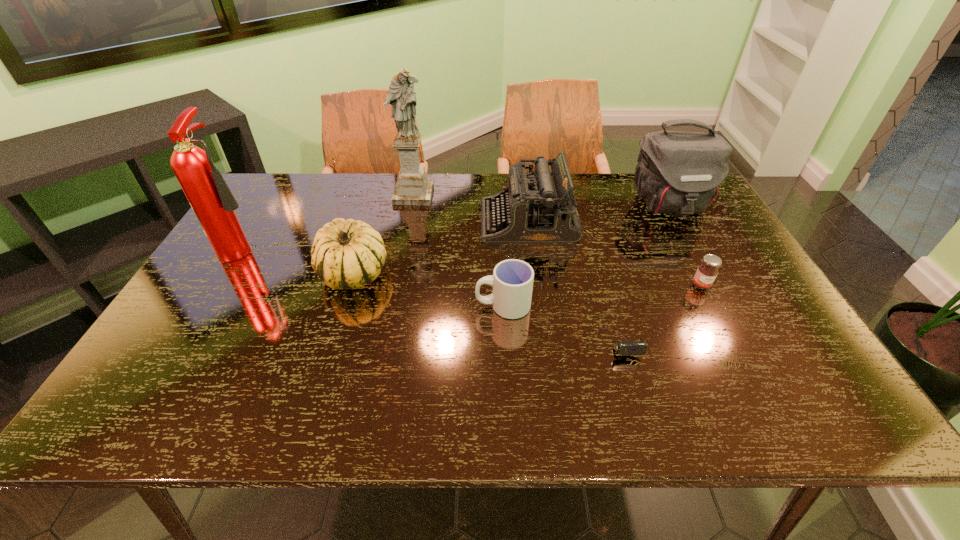
Locate an element on the screen. The width and height of the screenshot is (960, 540). sculpture is located at coordinates (412, 187).

You are a GUI agent. You are given a task and a screenshot of the screen. Output one action in this format:
    pyautogui.click(x=<x>, y=<y>)
    Task: Click on the fire extinguisher
    The image size is (960, 540).
    Given the screenshot: What is the action you would take?
    pyautogui.click(x=213, y=203)

This screenshot has height=540, width=960. I want to click on the sixth shortest object, so click(x=678, y=172).

You are a GUI agent. You are given a task and a screenshot of the screen. Output one action in this format:
    pyautogui.click(x=<x>, y=<y>)
    Task: Click on the fifth shortest object
    The image size is (960, 540).
    Given the screenshot: What is the action you would take?
    pyautogui.click(x=537, y=207)

Locate an element on the screen. gourd is located at coordinates (346, 254).

At what (x,y) coordinates should I click in order to perform the action: click on cup. Please return your answer as a coordinate pair (x, y). Image resolution: width=960 pixels, height=540 pixels. Looking at the image, I should click on (512, 280).

What are the coordinates of `jam` in the screenshot? It's located at (707, 271).

The width and height of the screenshot is (960, 540). What are the coordinates of `the shortest object` in the screenshot? It's located at (626, 347).

Identify the location of vacant space located on the front-facing side of the sculpture. (407, 226).

What are the coordinates of `vacant position located 0.220m at the nozzle of the fire extinguisher` in the screenshot? It's located at (342, 246).